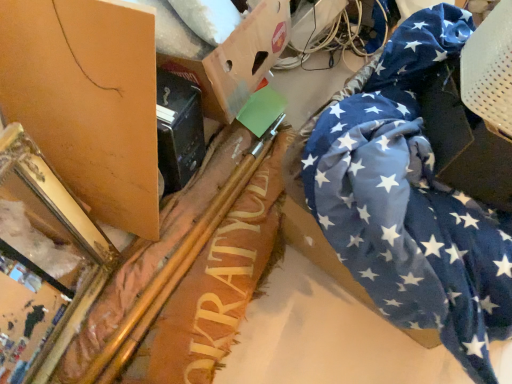
The image size is (512, 384). What are the coordinates of `blue fabric at right, positioned as the first cardboard box in right-to-left order` in the screenshot? It's located at (475, 113).

The height and width of the screenshot is (384, 512). What do you see at coordinates (410, 202) in the screenshot? I see `blue star-patterned fabric at right` at bounding box center [410, 202].

Locate an element on the screen. gold metallic mirror at left is located at coordinates click(x=42, y=262).

From a real-world perspective, is blue fabric at right, positioned as the first cardboard box in right-to-left order, physically below white perforated plastic swivel chair at upper right?

Yes.

Does blue fabric at right, marked as the 3th cardboard box in a left-to-right arrangement, have a greater height compared to white perforated plastic swivel chair at upper right?

Indeed, blue fabric at right, marked as the 3th cardboard box in a left-to-right arrangement, has a greater height compared to white perforated plastic swivel chair at upper right.

From the image's perspective, does blue fabric at right, positioned as the first cardboard box in right-to-left order, appear higher than white perforated plastic swivel chair at upper right?

No, from the image's perspective, blue fabric at right, positioned as the first cardboard box in right-to-left order, is not over white perforated plastic swivel chair at upper right.

The height and width of the screenshot is (384, 512). In order to click on window frame located below the matte brown cardboard at upper left, the 1th cardboard box when ordered from left to right (from the image's perspective) in this screenshot , I will do `click(42, 262)`.

From the image's perspective, is gold metallic mirror at left above or below matte brown cardboard at upper left, the 1th cardboard box when ordered from left to right?

gold metallic mirror at left is below matte brown cardboard at upper left, the 1th cardboard box when ordered from left to right.

Which is more to the left, gold metallic mirror at left or green plastic wire at upper center?

From the viewer's perspective, gold metallic mirror at left appears more on the left side.

Is gold metallic mirror at left facing towards green plastic wire at upper center?

No, gold metallic mirror at left is not oriented towards green plastic wire at upper center.

From a real-world perspective, which object rests below the other?

green plastic wire at upper center, from a real-world perspective.

Where is `wire located underneath the gold metallic mirror at left (from a real-world perspective)`? Image resolution: width=512 pixels, height=384 pixels. wire located underneath the gold metallic mirror at left (from a real-world perspective) is located at coordinates [324, 32].

Is cardboard box at upper center, positioned as the second cardboard box in right-to-left order, next to white perforated plastic swivel chair at upper right and touching it?

No, cardboard box at upper center, positioned as the second cardboard box in right-to-left order, is not with white perforated plastic swivel chair at upper right.

Is cardboard box at upper center, the second cardboard box when ordered from left to right, located outside white perforated plastic swivel chair at upper right?

Absolutely, cardboard box at upper center, the second cardboard box when ordered from left to right, is external to white perforated plastic swivel chair at upper right.

Considering the sizes of objects cardboard box at upper center, the second cardboard box when ordered from left to right, and white perforated plastic swivel chair at upper right in the image provided, who is bigger, cardboard box at upper center, the second cardboard box when ordered from left to right, or white perforated plastic swivel chair at upper right?

cardboard box at upper center, the second cardboard box when ordered from left to right.

Is white perforated plastic swivel chair at upper right outside of cardboard box at upper center, the second cardboard box when ordered from left to right?

Yes.

Which is more to the right, white perforated plastic swivel chair at upper right or cardboard box at upper center, positioned as the second cardboard box in right-to-left order?

white perforated plastic swivel chair at upper right.

From a real-world perspective, is white perforated plastic swivel chair at upper right positioned above or below cardboard box at upper center, the second cardboard box when ordered from left to right?

Clearly, from a real-world perspective, white perforated plastic swivel chair at upper right is above cardboard box at upper center, the second cardboard box when ordered from left to right.

Could you tell me if green plastic wire at upper center is facing blue fabric at right, marked as the 3th cardboard box in a left-to-right arrangement?

No, green plastic wire at upper center does not turn towards blue fabric at right, marked as the 3th cardboard box in a left-to-right arrangement.

How distant is green plastic wire at upper center from blue fabric at right, positioned as the first cardboard box in right-to-left order?

green plastic wire at upper center and blue fabric at right, positioned as the first cardboard box in right-to-left order, are 37.24 inches apart from each other.

Is the position of green plastic wire at upper center more distant than that of blue fabric at right, positioned as the first cardboard box in right-to-left order?

Yes, it is behind blue fabric at right, positioned as the first cardboard box in right-to-left order.

Is green plastic wire at upper center touching blue fabric at right, marked as the 3th cardboard box in a left-to-right arrangement?

green plastic wire at upper center is not next to blue fabric at right, marked as the 3th cardboard box in a left-to-right arrangement, and they're not touching.

Can you confirm if white perforated plastic swivel chair at upper right is taller than matte brown cardboard at upper left, the 1th cardboard box when ordered from left to right?

No, white perforated plastic swivel chair at upper right is not taller than matte brown cardboard at upper left, the 1th cardboard box when ordered from left to right.

From the image's perspective, relative to matte brown cardboard at upper left, the 1th cardboard box when ordered from left to right, is white perforated plastic swivel chair at upper right above or below?

Based on their image positions, white perforated plastic swivel chair at upper right is located above matte brown cardboard at upper left, the 1th cardboard box when ordered from left to right.

Are white perforated plastic swivel chair at upper right and matte brown cardboard at upper left, the 1th cardboard box when ordered from left to right, far apart?

Actually, white perforated plastic swivel chair at upper right and matte brown cardboard at upper left, the 1th cardboard box when ordered from left to right, are a little close together.

Based on their sizes in the image, would you say white perforated plastic swivel chair at upper right is bigger or smaller than matte brown cardboard at upper left, which appears as the third cardboard box when viewed from the right?

white perforated plastic swivel chair at upper right is smaller than matte brown cardboard at upper left, which appears as the third cardboard box when viewed from the right.

The height and width of the screenshot is (384, 512). Identify the location of swivel chair to the left of blue fabric at right, positioned as the first cardboard box in right-to-left order. (490, 71).

You are a GUI agent. You are given a task and a screenshot of the screen. Output one action in this format:
    pyautogui.click(x=<x>, y=<y>)
    Task: Click on the 1st cardboard box above when counting from the gold metallic mirror at left (from the image's perspective)
    Image resolution: width=512 pixels, height=384 pixels.
    Given the screenshot: What is the action you would take?
    pyautogui.click(x=88, y=100)

When comparing their distances from green plastic wire at upper center, does blue fabric at right, marked as the 3th cardboard box in a left-to-right arrangement, or white perforated plastic swivel chair at upper right seem closer?

white perforated plastic swivel chair at upper right is closer to green plastic wire at upper center.

When comparing their distances from green plastic wire at upper center, does gold metallic mirror at left or white perforated plastic swivel chair at upper right seem closer?

white perforated plastic swivel chair at upper right is positioned closer to the anchor green plastic wire at upper center.

Estimate the real-world distances between objects in this image. Which object is further from blue star-patterned fabric at right, green plastic wire at upper center or blue fabric at right, marked as the 3th cardboard box in a left-to-right arrangement?

green plastic wire at upper center is positioned further to the anchor blue star-patterned fabric at right.

In the scene shown: When comparing their distances from white perforated plastic swivel chair at upper right, does blue fabric at right, positioned as the first cardboard box in right-to-left order, or cardboard box at upper center, the second cardboard box when ordered from left to right, seem further?

cardboard box at upper center, the second cardboard box when ordered from left to right, is positioned further to the anchor white perforated plastic swivel chair at upper right.

Which object lies nearer to the anchor point gold metallic mirror at left, white perforated plastic swivel chair at upper right or blue fabric at right, positioned as the first cardboard box in right-to-left order?

Based on the image, blue fabric at right, positioned as the first cardboard box in right-to-left order, appears to be nearer to gold metallic mirror at left.

Estimate the real-world distances between objects in this image. Which object is closer to blue fabric at right, marked as the 3th cardboard box in a left-to-right arrangement, green plastic wire at upper center or gold metallic mirror at left?

Based on the image, green plastic wire at upper center appears to be nearer to blue fabric at right, marked as the 3th cardboard box in a left-to-right arrangement.

Estimate the real-world distances between objects in this image. Which object is further from blue fabric at right, positioned as the first cardboard box in right-to-left order, white perforated plastic swivel chair at upper right or matte brown cardboard at upper left, the 1th cardboard box when ordered from left to right?

matte brown cardboard at upper left, the 1th cardboard box when ordered from left to right, lies further to blue fabric at right, positioned as the first cardboard box in right-to-left order, than the other object.

Based on their spatial positions, is gold metallic mirror at left or blue star-patterned fabric at right closer to white perforated plastic swivel chair at upper right?

Based on the image, blue star-patterned fabric at right appears to be nearer to white perforated plastic swivel chair at upper right.

This screenshot has height=384, width=512. In order to click on wire situated between matte brown cardboard at upper left, which appears as the third cardboard box when viewed from the right, and blue fabric at right, marked as the 3th cardboard box in a left-to-right arrangement, from left to right in this screenshot , I will do `click(324, 32)`.

Locate an element on the screen. swivel chair between blue star-patterned fabric at right and green plastic wire at upper center in the front-back direction is located at coordinates tap(490, 71).

The width and height of the screenshot is (512, 384). Identify the location of cardboard box situated between matte brown cardboard at upper left, which appears as the third cardboard box when viewed from the right, and white perforated plastic swivel chair at upper right from left to right. coord(223,54).

You are a GUI agent. You are given a task and a screenshot of the screen. Output one action in this format:
    pyautogui.click(x=<x>, y=<y>)
    Task: Click on the flag between matte brown cardboard at upper left, which appears as the third cardboard box when viewed from the right, and white perforated plastic swivel chair at upper right
    
    Given the screenshot: What is the action you would take?
    pyautogui.click(x=410, y=202)